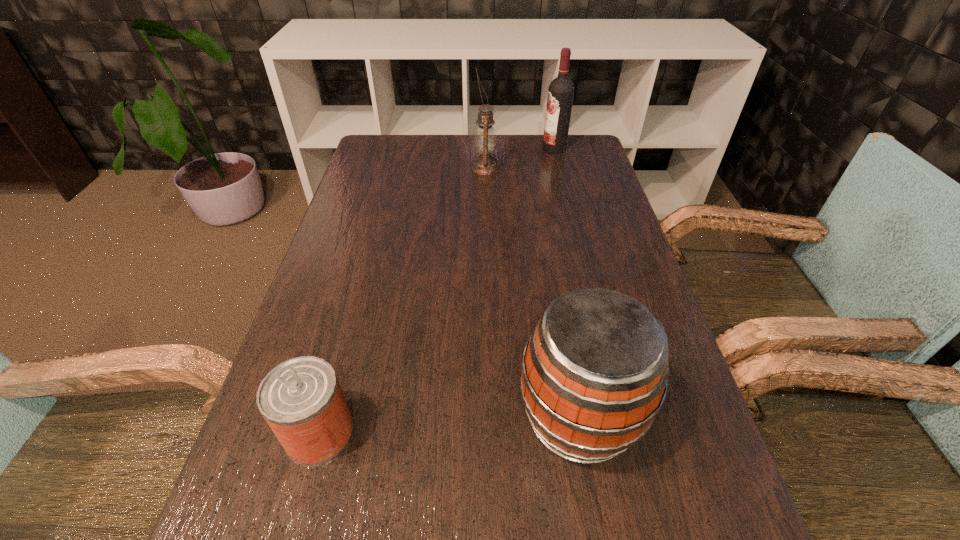
I want to click on wine bottle, so click(561, 90).

Locate an element on the screen. The image size is (960, 540). oil lamp is located at coordinates (485, 142).

The image size is (960, 540). Identify the location of the second object from left to right. (485, 142).

At what (x,y) coordinates should I click in order to perform the action: click on cider. Please return your answer as a coordinate pair (x, y). This screenshot has width=960, height=540. Looking at the image, I should click on (594, 374).

This screenshot has height=540, width=960. I want to click on the shortest object, so click(x=301, y=399).

You are a GUI agent. You are given a task and a screenshot of the screen. Output one action in this format:
    pyautogui.click(x=<x>, y=<y>)
    Task: Click on the can
    
    Given the screenshot: What is the action you would take?
    click(301, 399)

Identify the location of free point located 0.240m on the label of the wine bottle. This screenshot has height=540, width=960. (471, 148).

Identify the location of blank space located on the label of the wine bottle. (516, 148).

At what (x,y) coordinates should I click in order to perform the action: click on free space located 0.260m on the label of the wine bottle. Please return your answer as a coordinate pair (x, y). Looking at the image, I should click on (466, 148).

Where is `free space located 0.340m on the left of the oil lamp`? free space located 0.340m on the left of the oil lamp is located at coordinates (364, 168).